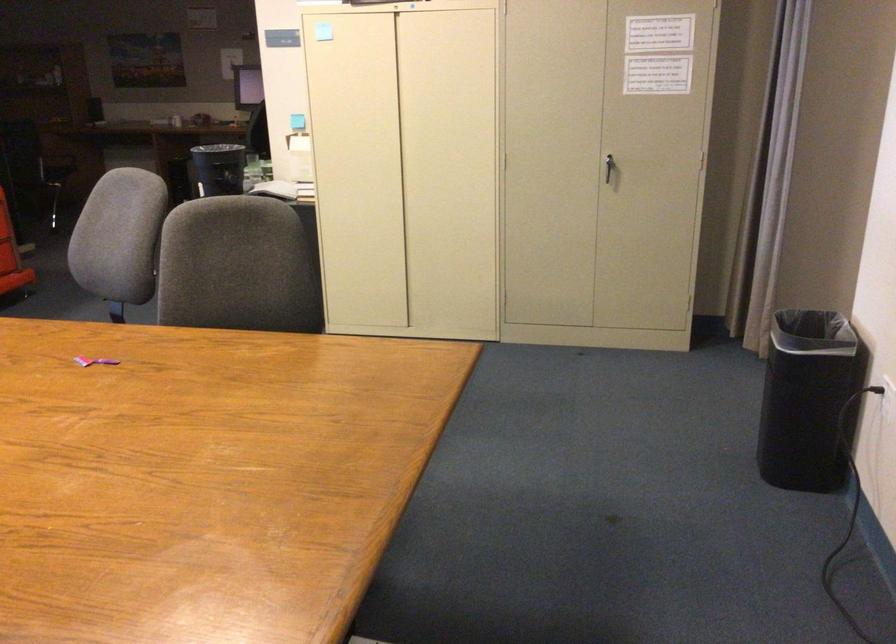
Where is `cabinet handle`? cabinet handle is located at coordinates (609, 169).